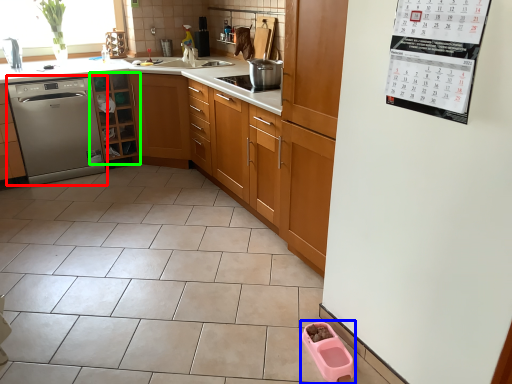
Question: Which is farther away from dishwasher (highlighted by a red box)? appliance (highlighted by a blue box) or cabinetry (highlighted by a green box)?

Choices:
 (A) appliance
 (B) cabinetry

Answer: (A)